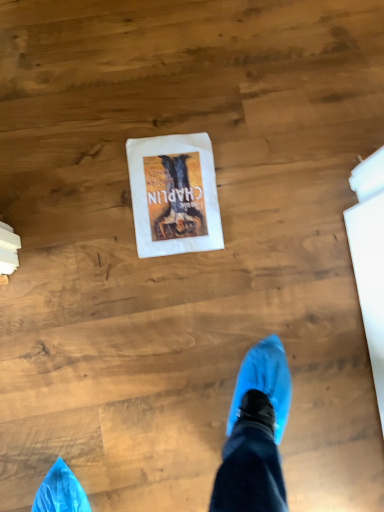
This screenshot has height=512, width=384. What do you see at coordinates (174, 194) in the screenshot? I see `white paper at center` at bounding box center [174, 194].

Locate an element on the screen. This screenshot has width=384, height=512. white paper at center is located at coordinates (174, 194).

At what (x,y) coordinates should I click in order to perform the action: click on white paper at center. Please return your answer as a coordinate pair (x, y). This screenshot has width=384, height=512. Looking at the image, I should click on (174, 194).